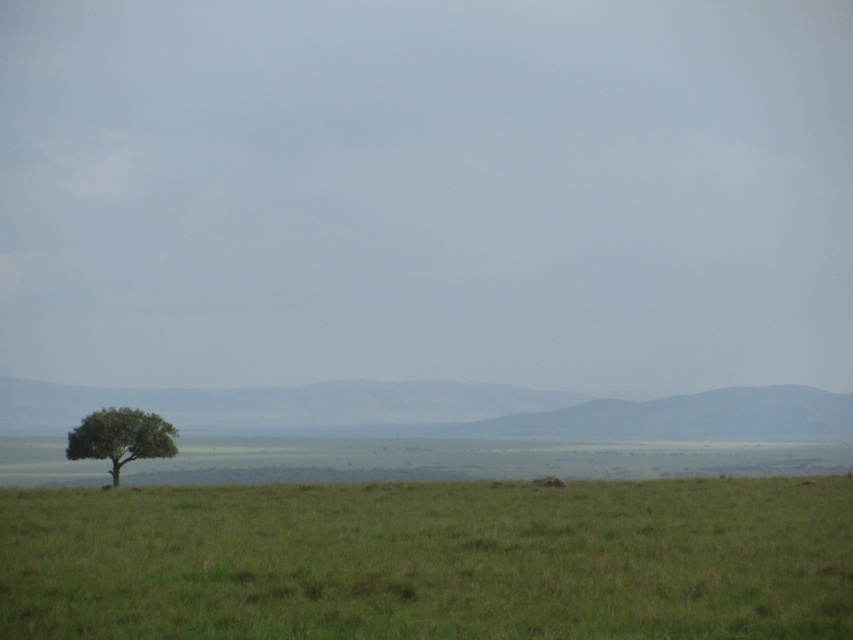
Who is more forward, (747, 480) or (166, 422)?

Point (747, 480) is in front.

Can you confirm if green grassy plain at lower center is positioned to the right of green leafy tree at lower left?

Correct, you'll find green grassy plain at lower center to the right of green leafy tree at lower left.

Identify the location of green grassy plain at lower center. 431,561.

Where is `green grassy plain at lower center`? This screenshot has width=853, height=640. green grassy plain at lower center is located at coordinates (431, 561).